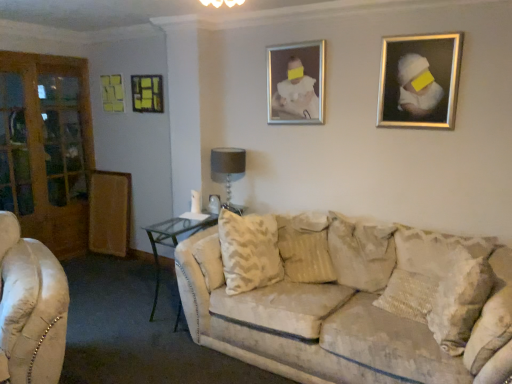
The image size is (512, 384). In order to click on clear glass table at center in this screenshot , I will do `click(172, 240)`.

Identify the location of beige textured pillow at center, the 3th pillow viewed from the right. The height and width of the screenshot is (384, 512). (305, 248).

Would you say textured beige pillow at right, which is counted as the third pillow, starting from the left, is to the left or to the right of metallic silver picture frame at upper left, marked as the 3th picture frame in a right-to-left arrangement, in the picture?

textured beige pillow at right, which is counted as the third pillow, starting from the left, is to the right of metallic silver picture frame at upper left, marked as the 3th picture frame in a right-to-left arrangement.

Between point (485, 259) and point (159, 105), which one is positioned in front?

The point (485, 259) is more forward.

From the image's perspective, is textured beige pillow at right, the 1th pillow in the right-to-left sequence, located above metallic silver picture frame at upper left, the 3th picture frame in the front-to-back sequence?

Actually, textured beige pillow at right, the 1th pillow in the right-to-left sequence, appears below metallic silver picture frame at upper left, the 3th picture frame in the front-to-back sequence, in the image.

Is metallic silver picture frame at upper left, marked as the 3th picture frame in a right-to-left arrangement, completely or partially inside textured beige pillow at right, which is counted as the third pillow, starting from the left?

No, metallic silver picture frame at upper left, marked as the 3th picture frame in a right-to-left arrangement, is not inside textured beige pillow at right, which is counted as the third pillow, starting from the left.

Considering the sizes of objects textured beige pillow at center, placed as the second pillow when sorted from left to right, and gray fabric lampshade at center in the image provided, who is bigger, textured beige pillow at center, placed as the second pillow when sorted from left to right, or gray fabric lampshade at center?

textured beige pillow at center, placed as the second pillow when sorted from left to right.

From a real-world perspective, is textured beige pillow at center, acting as the second pillow starting from the right, beneath gray fabric lampshade at center?

Yes.

Is textured beige pillow at center, placed as the second pillow when sorted from left to right, wider than gray fabric lampshade at center?

Correct, the width of textured beige pillow at center, placed as the second pillow when sorted from left to right, exceeds that of gray fabric lampshade at center.

Based on the photo, can you confirm if textured beige pillow at center, acting as the second pillow starting from the right, is taller than gray fabric lampshade at center?

Yes, textured beige pillow at center, acting as the second pillow starting from the right, is taller than gray fabric lampshade at center.

From the picture: In terms of size, does silver metallic picture frame at upper center, the third picture frame from the left, appear bigger or smaller than textured beige pillow at center, acting as the second pillow starting from the right?

In the image, silver metallic picture frame at upper center, the third picture frame from the left, appears to be smaller than textured beige pillow at center, acting as the second pillow starting from the right.

Choose the correct answer: Is silver metallic picture frame at upper center, the 3th picture frame when ordered from back to front, inside textured beige pillow at center, acting as the second pillow starting from the right, or outside it?

silver metallic picture frame at upper center, the 3th picture frame when ordered from back to front, exists outside the volume of textured beige pillow at center, acting as the second pillow starting from the right.

From the image's perspective, which one is positioned higher, silver metallic picture frame at upper center, marked as the 2th picture frame in a front-to-back arrangement, or textured beige pillow at center, acting as the second pillow starting from the right?

From the image's view, silver metallic picture frame at upper center, marked as the 2th picture frame in a front-to-back arrangement, is above.

Is gray fabric lampshade at center positioned in front of silver metallic picture frame at upper right, the 4th picture frame from the back?

No, it is behind silver metallic picture frame at upper right, the 4th picture frame from the back.

What's the angular difference between gray fabric lampshade at center and silver metallic picture frame at upper right, the 1th picture frame positioned from the front,'s facing directions?

They differ by 1.6 degrees in their facing directions.

From a real-world perspective, does gray fabric lampshade at center sit lower than silver metallic picture frame at upper right, the first picture frame in the right-to-left sequence?

Yes, from a real-world perspective, gray fabric lampshade at center is beneath silver metallic picture frame at upper right, the first picture frame in the right-to-left sequence.

From the image's perspective, between gray fabric lampshade at center and silver metallic picture frame at upper right, which ranks as the 4th picture frame in left-to-right order, who is located below?

gray fabric lampshade at center, from the image's perspective.

Is beige textured pillow at center, the 3th pillow viewed from the right, closer to the viewer compared to metallic silver picture frame at upper left, marked as the 3th picture frame in a right-to-left arrangement?

Yes, it is.

Which of these two, beige textured pillow at center, which is the 1th pillow in left-to-right order, or metallic silver picture frame at upper left, marked as the 3th picture frame in a right-to-left arrangement, stands taller?

Standing taller between the two is metallic silver picture frame at upper left, marked as the 3th picture frame in a right-to-left arrangement.

From a real-world perspective, is beige textured pillow at center, which is the 1th pillow in left-to-right order, above or below metallic silver picture frame at upper left, arranged as the 2th picture frame when viewed from the left?

beige textured pillow at center, which is the 1th pillow in left-to-right order, is below metallic silver picture frame at upper left, arranged as the 2th picture frame when viewed from the left.

Based on the photo, between beige textured pillow at center, which is the 1th pillow in left-to-right order, and metallic silver picture frame at upper left, positioned as the second picture frame in back-to-front order, which one has smaller width?

metallic silver picture frame at upper left, positioned as the second picture frame in back-to-front order.

Which object is more forward, clear glass table at center or beige textured pillow at center, which is the 1th pillow in left-to-right order?

Positioned in front is beige textured pillow at center, which is the 1th pillow in left-to-right order.

Is beige textured pillow at center, which is the 1th pillow in left-to-right order, inside clear glass table at center?

No.

From a real-world perspective, who is located lower, clear glass table at center or beige textured pillow at center, which is the 1th pillow in left-to-right order?

clear glass table at center is physically lower.

Is textured beige pillow at center, acting as the second pillow starting from the right, to the left of beige textured pillow at center, the 3th pillow viewed from the right, from the viewer's perspective?

No, textured beige pillow at center, acting as the second pillow starting from the right, is not to the left of beige textured pillow at center, the 3th pillow viewed from the right.

Can you see textured beige pillow at center, placed as the second pillow when sorted from left to right, touching beige textured pillow at center, the 3th pillow viewed from the right?

No, textured beige pillow at center, placed as the second pillow when sorted from left to right, is not with beige textured pillow at center, the 3th pillow viewed from the right.

Do you think textured beige pillow at center, placed as the second pillow when sorted from left to right, is within beige textured pillow at center, which is the 1th pillow in left-to-right order, or outside of it?

textured beige pillow at center, placed as the second pillow when sorted from left to right, is outside beige textured pillow at center, which is the 1th pillow in left-to-right order.

Looking at this image, which of these two, textured beige pillow at center, placed as the second pillow when sorted from left to right, or beige textured pillow at center, the 3th pillow viewed from the right, is thinner?

With smaller width is beige textured pillow at center, the 3th pillow viewed from the right.

Where is `the 3rd pillow to the right of the metallic silver picture frame at upper left, marked as the 3th picture frame in a right-to-left arrangement, counting from the anchor's position`? The width and height of the screenshot is (512, 384). the 3rd pillow to the right of the metallic silver picture frame at upper left, marked as the 3th picture frame in a right-to-left arrangement, counting from the anchor's position is located at coordinates (460, 300).

The image size is (512, 384). Identify the location of the 1st pillow below the gray fabric lampshade at center (from the image's perspective). tap(361, 252).

Estimate the real-world distances between objects in this image. Which object is closer to clear glass table at center, beige textured pillow at center, the 3th pillow viewed from the right, or textured beige pillow at center, placed as the second pillow when sorted from left to right?

beige textured pillow at center, the 3th pillow viewed from the right.

Considering their positions, is textured beige pillow at center, placed as the second pillow when sorted from left to right, positioned further to clear glass table at center than metallic silver picture frame at upper left, acting as the first picture frame starting from the left?

metallic silver picture frame at upper left, acting as the first picture frame starting from the left, is further to clear glass table at center.

Looking at the image, which one is located further to metallic silver picture frame at upper left, marked as the 3th picture frame in a right-to-left arrangement, silver metallic picture frame at upper center, which appears as the 2th picture frame when viewed from the right, or beige textured pillow at center, the 3th pillow viewed from the right?

Among the two, beige textured pillow at center, the 3th pillow viewed from the right, is located further to metallic silver picture frame at upper left, marked as the 3th picture frame in a right-to-left arrangement.

Looking at the image, which one is located further to textured beige pillow at right, the 1th pillow in the right-to-left sequence, gray fabric lampshade at center or clear glass table at center?

gray fabric lampshade at center.

Looking at the image, which one is located further to silver metallic picture frame at upper center, the 3th picture frame when ordered from back to front, beige textured pillow at center, which is the 1th pillow in left-to-right order, or textured beige pillow at right, the 1th pillow in the right-to-left sequence?

textured beige pillow at right, the 1th pillow in the right-to-left sequence, lies further to silver metallic picture frame at upper center, the 3th picture frame when ordered from back to front, than the other object.

From the image, which object appears to be farther from silver metallic picture frame at upper right, the 4th picture frame from the back, clear glass table at center or metallic silver picture frame at upper left, arranged as the 2th picture frame when viewed from the left?

The object further to silver metallic picture frame at upper right, the 4th picture frame from the back, is metallic silver picture frame at upper left, arranged as the 2th picture frame when viewed from the left.

When comparing their distances from silver metallic picture frame at upper center, the third picture frame from the left, does textured beige pillow at center, placed as the second pillow when sorted from left to right, or silver metallic picture frame at upper right, which ranks as the 4th picture frame in left-to-right order, seem closer?

silver metallic picture frame at upper right, which ranks as the 4th picture frame in left-to-right order, is closer to silver metallic picture frame at upper center, the third picture frame from the left.

Consider the image. Based on their spatial positions, is silver metallic picture frame at upper center, the third picture frame from the left, or metallic silver picture frame at upper left, marked as the 3th picture frame in a right-to-left arrangement, closer to textured beige pillow at center, acting as the second pillow starting from the right?

The object closer to textured beige pillow at center, acting as the second pillow starting from the right, is silver metallic picture frame at upper center, the third picture frame from the left.

Identify the location of picture frame located between metallic silver picture frame at upper left, the 3th picture frame in the front-to-back sequence, and silver metallic picture frame at upper right, the 1th picture frame positioned from the front, in the left-right direction. Image resolution: width=512 pixels, height=384 pixels. (296, 83).

Where is `table lamp between silver metallic picture frame at upper center, the third picture frame from the left, and beige textured pillow at center, which is the 1th pillow in left-to-right order, in the vertical direction`? This screenshot has width=512, height=384. table lamp between silver metallic picture frame at upper center, the third picture frame from the left, and beige textured pillow at center, which is the 1th pillow in left-to-right order, in the vertical direction is located at coordinates (228, 170).

What are the coordinates of `table lamp situated between metallic silver picture frame at upper left, positioned as the second picture frame in back-to-front order, and textured beige pillow at center, acting as the second pillow starting from the right, from left to right` in the screenshot? It's located at (228, 170).

Locate an element on the screen. table lamp situated between clear glass table at center and textured beige pillow at right, which is counted as the third pillow, starting from the left, from left to right is located at coordinates (228, 170).